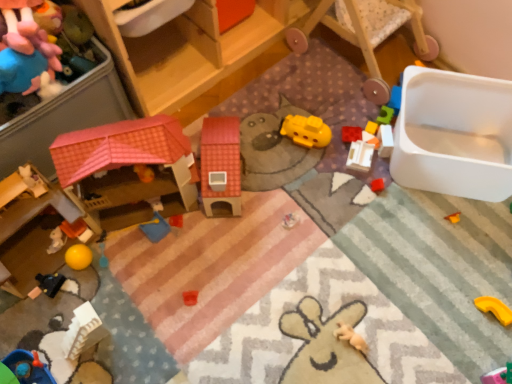
Question: Is rubber brick at upper right, which appears as the fifth toy when viewed from the right, not within yellow matte submarine at center, the 7th toy when ordered from right to left?

Choices:
 (A) yes
 (B) no

Answer: (A)

Question: Considering the relative positions of rubber brick at upper right, which appears as the fifth toy when viewed from the right, and yellow matte submarine at center, which is the 5th toy in left-to-right order, in the image provided, is rubber brick at upper right, which appears as the fifth toy when viewed from the right, to the left of yellow matte submarine at center, which is the 5th toy in left-to-right order, from the viewer's perspective?

Choices:
 (A) yes
 (B) no

Answer: (B)

Question: From the image's perspective, is rubber brick at upper right, which appears as the fifth toy when viewed from the right, located beneath yellow matte submarine at center, the 7th toy when ordered from right to left?

Choices:
 (A) yes
 (B) no

Answer: (A)

Question: From the image's perspective, would you say rubber brick at upper right, placed as the 7th toy when sorted from left to right, is positioned over yellow matte submarine at center, which is the 5th toy in left-to-right order?

Choices:
 (A) yes
 (B) no

Answer: (B)

Question: Considering the relative sizes of rubber brick at upper right, placed as the 7th toy when sorted from left to right, and yellow matte submarine at center, which is the 5th toy in left-to-right order, in the image provided, is rubber brick at upper right, placed as the 7th toy when sorted from left to right, thinner than yellow matte submarine at center, which is the 5th toy in left-to-right order,?

Choices:
 (A) no
 (B) yes

Answer: (B)

Question: Based on their positions, is black matte toy car at lower left, arranged as the 2th toy when viewed from the left, located to the left or right of wooden dollhouse at upper left?

Choices:
 (A) left
 (B) right

Answer: (A)

Question: In terms of height, does black matte toy car at lower left, the tenth toy viewed from the right, look taller or shorter compared to wooden dollhouse at upper left?

Choices:
 (A) tall
 (B) short

Answer: (B)

Question: From the image's perspective, is black matte toy car at lower left, arranged as the 2th toy when viewed from the left, positioned above or below wooden dollhouse at upper left?

Choices:
 (A) below
 (B) above

Answer: (A)

Question: Which is correct: black matte toy car at lower left, arranged as the 2th toy when viewed from the left, is inside wooden dollhouse at upper left, or outside of it?

Choices:
 (A) inside
 (B) outside

Answer: (B)

Question: Considering their positions, is yellow rubber toy at lower right, positioned as the 11th toy in left-to-right order, located in front of or behind white plastic blocks at right, placed as the tenth toy when sorted from left to right?

Choices:
 (A) behind
 (B) front

Answer: (B)

Question: From a real-world perspective, is yellow rubber toy at lower right, which ranks as the 1th toy in right-to-left order, physically located above or below white plastic blocks at right, which is the second toy in right-to-left order?

Choices:
 (A) above
 (B) below

Answer: (B)

Question: Does point (476, 306) appear closer or farther from the camera than point (391, 127)?

Choices:
 (A) closer
 (B) farther

Answer: (A)

Question: In terms of width, does yellow rubber toy at lower right, which ranks as the 1th toy in right-to-left order, look wider or thinner when compared to white plastic blocks at right, which is the second toy in right-to-left order?

Choices:
 (A) thin
 (B) wide

Answer: (B)

Question: Is wooden rocking chair at upper right inside the boundaries of light brown plush toy at lower right, the sixth toy from the right, or outside?

Choices:
 (A) inside
 (B) outside

Answer: (B)

Question: Considering the positions of wooden rocking chair at upper right and light brown plush toy at lower right, which appears as the 6th toy when viewed from the left, in the image, is wooden rocking chair at upper right wider or thinner than light brown plush toy at lower right, which appears as the 6th toy when viewed from the left,?

Choices:
 (A) wide
 (B) thin

Answer: (A)